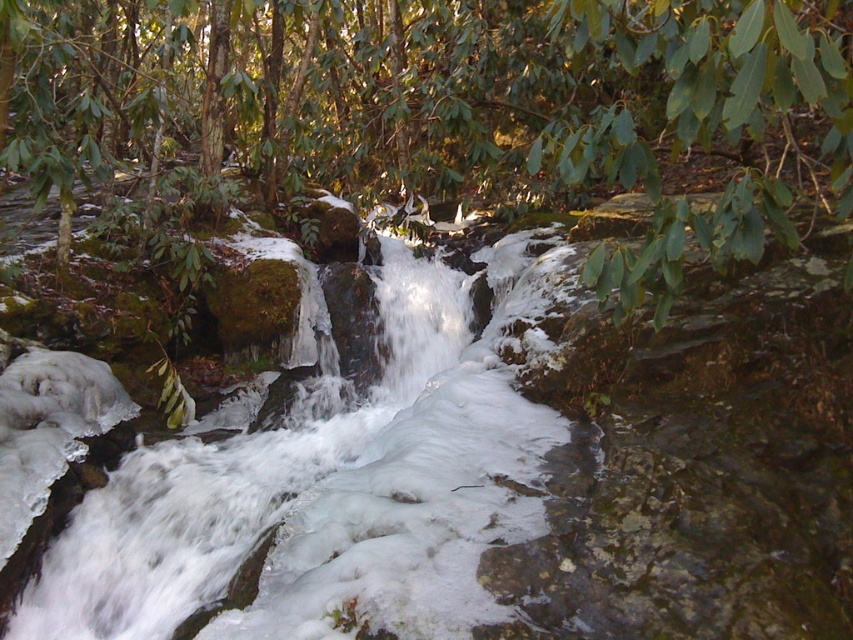
Between white frothy water at center and green leafy tree at center, which one has more height?

green leafy tree at center

Between point (479, 451) and point (657, 266), which one is positioned in front?

Point (657, 266) is in front.

Where is `white frothy water at center`? white frothy water at center is located at coordinates (502, 480).